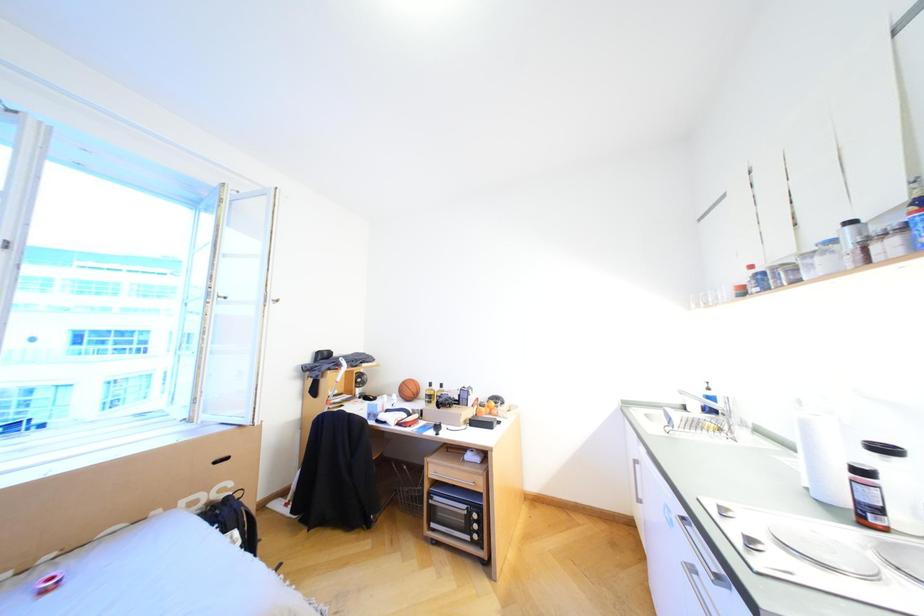
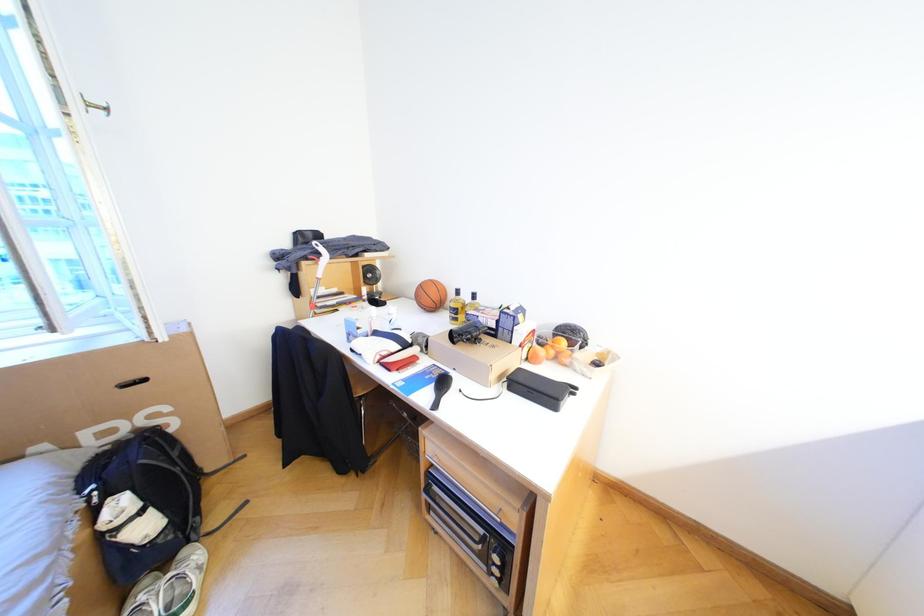
Question: Which direction would the cameraman need to move to produce the second image? Reply with the corresponding letter.

Choices:
 (A) Left
 (B) Right
 (C) Forward
 (D) Backward

Answer: (C)